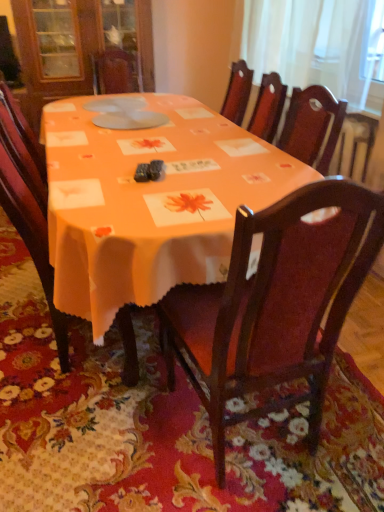
Locate an element on the screen. The image size is (384, 512). vacant area to the left of wooden chair at center, the 2th chair viewed from the right is located at coordinates (18, 336).